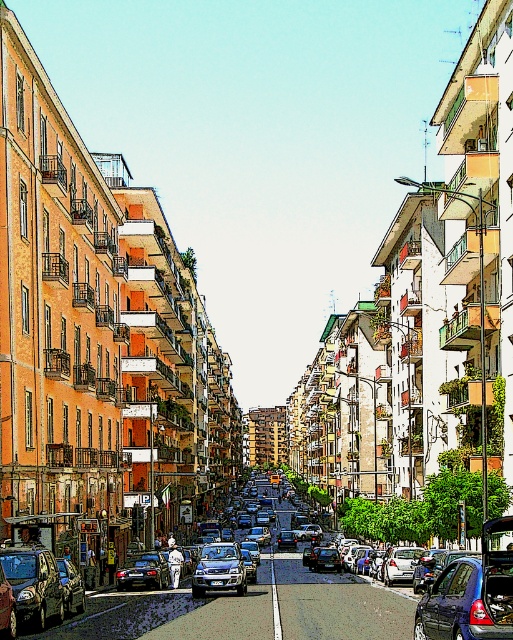
The width and height of the screenshot is (513, 640). What do you see at coordinates (33, 584) in the screenshot?
I see `metallic silver car at center-left` at bounding box center [33, 584].

Is point (26, 592) positioned behind point (246, 579)?

That is False.

The width and height of the screenshot is (513, 640). In order to click on metallic silver car at center-left in this screenshot , I will do `click(33, 584)`.

Find the location of a particular element. The height and width of the screenshot is (640, 513). metallic silver car at center-left is located at coordinates (33, 584).

The width and height of the screenshot is (513, 640). Describe the element at coordinates (463, 605) in the screenshot. I see `metallic blue hatchback at center` at that location.

Can you confirm if metallic blue hatchback at center is thinner than black plastic license plate at center?

No, metallic blue hatchback at center is not thinner than black plastic license plate at center.

This screenshot has width=513, height=640. I want to click on metallic blue hatchback at center, so click(x=463, y=605).

What do you see at coordinates (70, 586) in the screenshot? The image size is (513, 640). I see `metallic silver car at center` at bounding box center [70, 586].

Is metallic silver car at center shorter than black plastic license plate at center?

No, metallic silver car at center is not shorter than black plastic license plate at center.

Does point (68, 561) come behind point (215, 582)?

That is False.

Where is `metallic silver car at center`? metallic silver car at center is located at coordinates (70, 586).